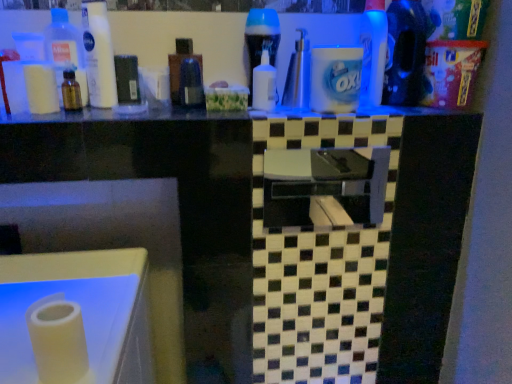
This screenshot has width=512, height=384. I want to click on free spot in front of translucent plastic soap dispenser at center, which ranks as the 1th bottle in right-to-left order, so click(x=288, y=111).